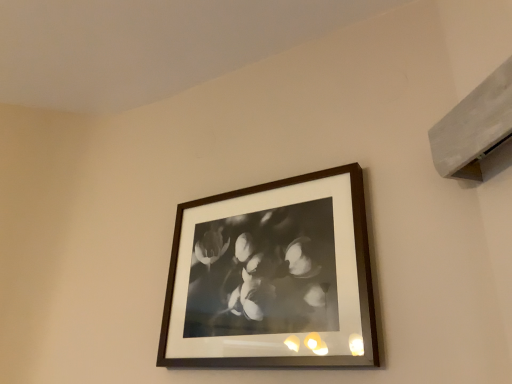
Image resolution: width=512 pixels, height=384 pixels. What are the coordinates of `wooden frame at upper center` in the screenshot? It's located at (272, 277).

Image resolution: width=512 pixels, height=384 pixels. What do you see at coordinates (272, 277) in the screenshot?
I see `wooden frame at upper center` at bounding box center [272, 277].

This screenshot has height=384, width=512. I want to click on wooden frame at upper center, so click(x=272, y=277).